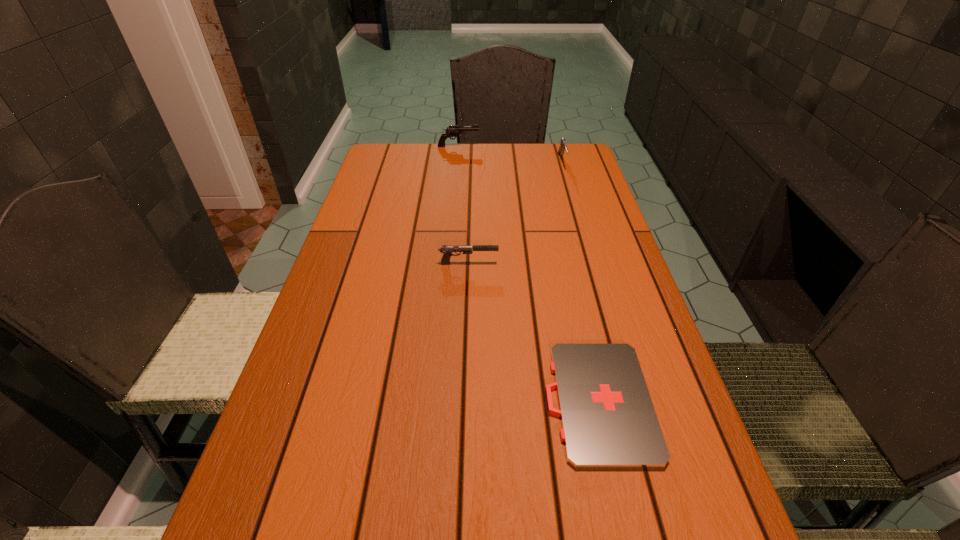
Where is `the farthest object`? The width and height of the screenshot is (960, 540). the farthest object is located at coordinates [x=452, y=131].

This screenshot has width=960, height=540. In order to click on the second farthest gun in this screenshot , I will do `click(562, 142)`.

Identify the location of the rightmost gun. This screenshot has width=960, height=540. pos(562,142).

Find the location of `the third tallest object`. the third tallest object is located at coordinates (447, 250).

Identify the location of the shortest gun. This screenshot has height=540, width=960. (447, 250).

This screenshot has width=960, height=540. I want to click on the shortest object, so click(608, 420).

Where is `the nearest object`? The height and width of the screenshot is (540, 960). the nearest object is located at coordinates (608, 420).

Locate an element on the screen. This screenshot has width=960, height=540. blank space located 0.100m at the end of the barrel of the farthest object is located at coordinates (507, 146).

You are a GUI agent. You are given a task and a screenshot of the screen. Output one action in this format:
    pyautogui.click(x=<x>, y=<y>)
    Task: Click on the vacant space positioned 0.180m at the barrel of the second nearest gun
    
    Given the screenshot: What is the action you would take?
    pyautogui.click(x=574, y=202)

Identify the location of vacant space situated 0.080m at the muzzle end of the second nearest object. (530, 263).